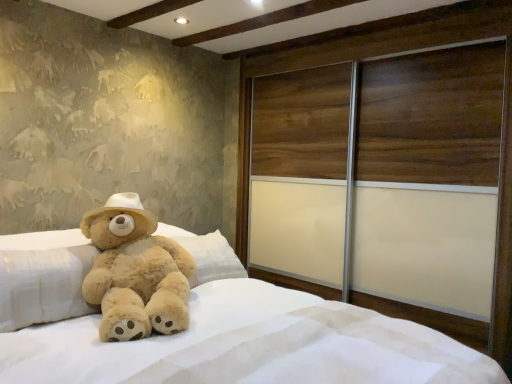
Question: Is fuzzy beige teddy bear at left thinner than wooden sliding door at right?

Choices:
 (A) yes
 (B) no

Answer: (A)

Question: Is fuzzy beige teddy bear at left positioned far away from wooden sliding door at right?

Choices:
 (A) no
 (B) yes

Answer: (B)

Question: From the image's perspective, is fuzzy beige teddy bear at left on wooden sliding door at right?

Choices:
 (A) yes
 (B) no

Answer: (B)

Question: Is fuzzy beige teddy bear at left smaller than wooden sliding door at right?

Choices:
 (A) no
 (B) yes

Answer: (B)

Question: Is fuzzy beige teddy bear at left outside wooden sliding door at right?

Choices:
 (A) no
 (B) yes

Answer: (B)

Question: Is fuzzy beige teddy bear at left inside the boundaries of wooden sliding door at right, or outside?

Choices:
 (A) inside
 (B) outside

Answer: (B)

Question: From the image's perspective, is fuzzy beige teddy bear at left above or below wooden sliding door at right?

Choices:
 (A) above
 (B) below

Answer: (B)

Question: Is fuzzy beige teddy bear at left bigger or smaller than wooden sliding door at right?

Choices:
 (A) big
 (B) small

Answer: (B)

Question: From a real-world perspective, relative to wooden sliding door at right, is fuzzy beige teddy bear at left vertically above or below?

Choices:
 (A) above
 (B) below

Answer: (B)

Question: Which is correct: soft plush bear at center is inside fuzzy beige teddy bear at left, or outside of it?

Choices:
 (A) inside
 (B) outside

Answer: (B)

Question: Considering the positions of point (265, 291) and point (158, 241), is point (265, 291) closer or farther from the camera than point (158, 241)?

Choices:
 (A) farther
 (B) closer

Answer: (A)

Question: In the image, is soft plush bear at center positioned in front of or behind fuzzy beige teddy bear at left?

Choices:
 (A) behind
 (B) front

Answer: (B)

Question: From their relative heights in the image, would you say soft plush bear at center is taller or shorter than fuzzy beige teddy bear at left?

Choices:
 (A) tall
 (B) short

Answer: (A)

Question: Would you say soft plush bear at center is inside or outside wooden sliding door at right?

Choices:
 (A) outside
 (B) inside

Answer: (A)

Question: Looking at their shapes, would you say soft plush bear at center is wider or thinner than wooden sliding door at right?

Choices:
 (A) wide
 (B) thin

Answer: (A)